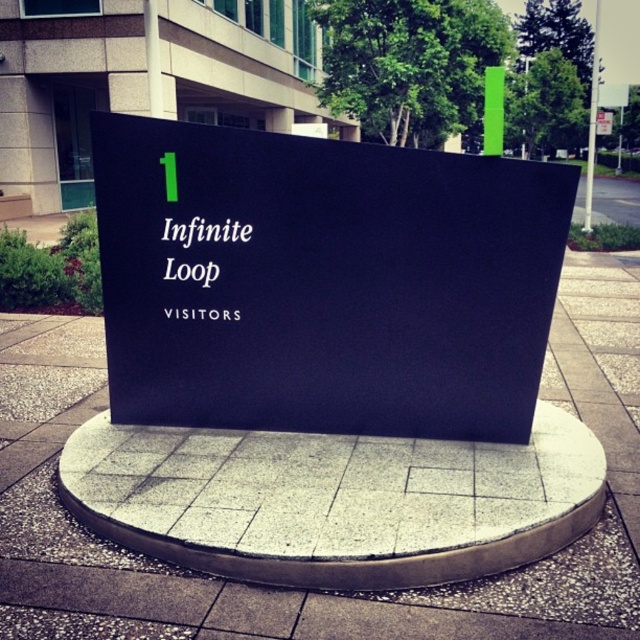
Question: Is black matte sign at center in front of white matte sign at center?

Choices:
 (A) yes
 (B) no

Answer: (A)

Question: Is the position of black matte sign at center more distant than that of white matte sign at center?

Choices:
 (A) no
 (B) yes

Answer: (A)

Question: Which of the following is the farthest from the observer?

Choices:
 (A) white matte sign at center
 (B) black matte sign at center

Answer: (A)

Question: Which of the following is the farthest from the observer?

Choices:
 (A) black matte sign at center
 (B) white matte sign at center

Answer: (B)

Question: Among these objects, which one is nearest to the camera?

Choices:
 (A) black matte sign at center
 (B) white matte sign at center

Answer: (A)

Question: Considering the relative positions of black matte sign at center and white matte sign at center in the image provided, where is black matte sign at center located with respect to white matte sign at center?

Choices:
 (A) above
 (B) below

Answer: (B)